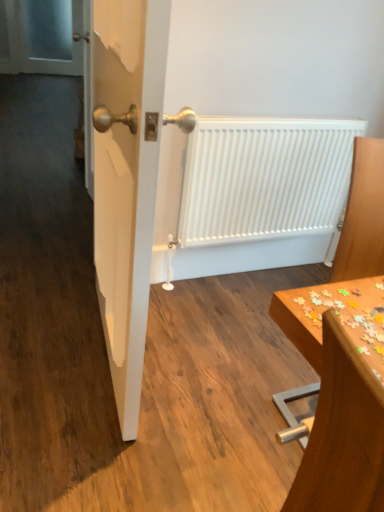
Measure the distance between point (x=268, y=188) and camera.

Point (x=268, y=188) and camera are 6.62 feet apart from each other.

Measure the distance between point (74, 65) and camera.

A distance of 6.10 meters exists between point (74, 65) and camera.

Image resolution: width=384 pixels, height=512 pixels. Describe the element at coordinates (339, 317) in the screenshot. I see `wooden puzzle pieces at lower right` at that location.

The height and width of the screenshot is (512, 384). In order to click on wooden puzzle pieces at lower right in this screenshot , I will do `click(339, 317)`.

Where is `wooden table at right`? wooden table at right is located at coordinates (347, 272).

Which object is thinner, wooden table at right or wooden puzzle pieces at lower right?

wooden puzzle pieces at lower right is thinner.

Relative to wooden puzzle pieces at lower right, is wooden table at right in front or behind?

wooden table at right is positioned farther from the viewer than wooden puzzle pieces at lower right.

Visually, is wooden table at right positioned to the left or to the right of wooden puzzle pieces at lower right?

Based on their positions, wooden table at right is located to the right of wooden puzzle pieces at lower right.

Which of these two, wooden table at right or wooden puzzle pieces at lower right, stands taller?

wooden table at right is taller.

Are white matte radiator at center and wooden table at right beside each other?

No, white matte radiator at center is not touching wooden table at right.

Considering the sizes of objects white matte radiator at center and wooden table at right in the image provided, who is thinner, white matte radiator at center or wooden table at right?

white matte radiator at center is thinner.

In the image, is white matte radiator at center positioned in front of or behind wooden table at right?

Clearly, white matte radiator at center is behind wooden table at right.

Locate an element on the screen. The width and height of the screenshot is (384, 512). radiator behind the wooden table at right is located at coordinates (264, 178).

Looking at this image, is transparent glass screen door at upper left a part of white matte radiator at center?

No, transparent glass screen door at upper left is not inside white matte radiator at center.

From a real-world perspective, which object stands above the other?

transparent glass screen door at upper left.

Are white matte radiator at center and transparent glass screen door at upper left making contact?

white matte radiator at center and transparent glass screen door at upper left are not in contact.

The image size is (384, 512). I want to click on table above the transparent glass screen door at upper left (from a real-world perspective), so click(x=339, y=317).

Between transparent glass screen door at upper left and wooden puzzle pieces at lower right, which one is positioned in front?

wooden puzzle pieces at lower right is more forward.

What's the angular difference between transparent glass screen door at upper left and wooden puzzle pieces at lower right's facing directions?

They differ by 90.7 degrees in their facing directions.

Can you confirm if wooden puzzle pieces at lower right is positioned to the left of white matte radiator at center?

Correct, you'll find wooden puzzle pieces at lower right to the left of white matte radiator at center.

Considering the relative sizes of wooden puzzle pieces at lower right and white matte radiator at center in the image provided, is wooden puzzle pieces at lower right thinner than white matte radiator at center?

No.

Identify the location of radiator that is above the wooden puzzle pieces at lower right (from the image's perspective). This screenshot has width=384, height=512. (264, 178).

Is white glossy door at center located within transparent glass screen door at upper left?

Actually, white glossy door at center is outside transparent glass screen door at upper left.

Consider the image. Is transparent glass screen door at upper left wider or thinner than white glossy door at center?

Considering their sizes, transparent glass screen door at upper left looks slimmer than white glossy door at center.

Is point (57, 26) more distant than point (107, 330)?

Yes, point (57, 26) is behind point (107, 330).

Does transparent glass screen door at upper left have a smaller size compared to white glossy door at center?

Indeed, transparent glass screen door at upper left has a smaller size compared to white glossy door at center.

Does transparent glass screen door at upper left turn towards white matte radiator at center?

Yes.

From the picture: Considering the relative sizes of transparent glass screen door at upper left and white matte radiator at center in the image provided, is transparent glass screen door at upper left smaller than white matte radiator at center?

Incorrect, transparent glass screen door at upper left is not smaller in size than white matte radiator at center.

Is transparent glass screen door at upper left in front of or behind white matte radiator at center in the image?

Visually, transparent glass screen door at upper left is located behind white matte radiator at center.

Is transparent glass screen door at upper left inside the boundaries of white matte radiator at center, or outside?

transparent glass screen door at upper left lies outside white matte radiator at center.

Locate an element on the screen. The width and height of the screenshot is (384, 512). table lying in front of the wooden table at right is located at coordinates (339, 317).

You are a GUI agent. You are given a task and a screenshot of the screen. Output one action in this format:
    pyautogui.click(x=<x>, y=<y>)
    Task: Click on the radiator above the wooden table at right (from the image's perspective)
    
    Given the screenshot: What is the action you would take?
    pyautogui.click(x=264, y=178)

Considering their positions, is wooden puzzle pieces at lower right positioned closer to white matte radiator at center than wooden table at right?

Based on the image, wooden table at right appears to be nearer to white matte radiator at center.

Based on their spatial positions, is wooden table at right or white glossy door at center closer to white matte radiator at center?

white glossy door at center is positioned closer to the anchor white matte radiator at center.

Estimate the real-world distances between objects in this image. Which object is further from white glossy door at center, wooden puzzle pieces at lower right or white matte radiator at center?

Among the two, white matte radiator at center is located further to white glossy door at center.

Which object lies further to the anchor point transparent glass screen door at upper left, wooden table at right or white matte radiator at center?

The object further to transparent glass screen door at upper left is wooden table at right.

Which object lies further to the anchor point white glossy door at center, wooden table at right or transparent glass screen door at upper left?

transparent glass screen door at upper left.

Considering their positions, is wooden puzzle pieces at lower right positioned further to transparent glass screen door at upper left than white matte radiator at center?

Based on the image, wooden puzzle pieces at lower right appears to be further to transparent glass screen door at upper left.

When comparing their distances from transparent glass screen door at upper left, does wooden puzzle pieces at lower right or white glossy door at center seem further?

Among the two, wooden puzzle pieces at lower right is located further to transparent glass screen door at upper left.

When comparing their distances from wooden table at right, does transparent glass screen door at upper left or white glossy door at center seem further?

transparent glass screen door at upper left is further to wooden table at right.

Locate an element on the screen. furniture positioned between wooden puzzle pieces at lower right and transparent glass screen door at upper left from near to far is located at coordinates (347, 272).

Locate an element on the screen. furniture located between white glossy door at center and transparent glass screen door at upper left in the depth direction is located at coordinates (347, 272).

Where is `door between wooden puzzle pieces at lower right and white matte radiator at center along the z-axis`? door between wooden puzzle pieces at lower right and white matte radiator at center along the z-axis is located at coordinates tap(127, 183).

You are a GUI agent. You are given a task and a screenshot of the screen. Output one action in this format:
    pyautogui.click(x=<x>, y=<y>)
    Task: Click on the furniture between white glossy door at center and white matte radiator at center along the z-axis
    This screenshot has width=384, height=512.
    Given the screenshot: What is the action you would take?
    pyautogui.click(x=347, y=272)